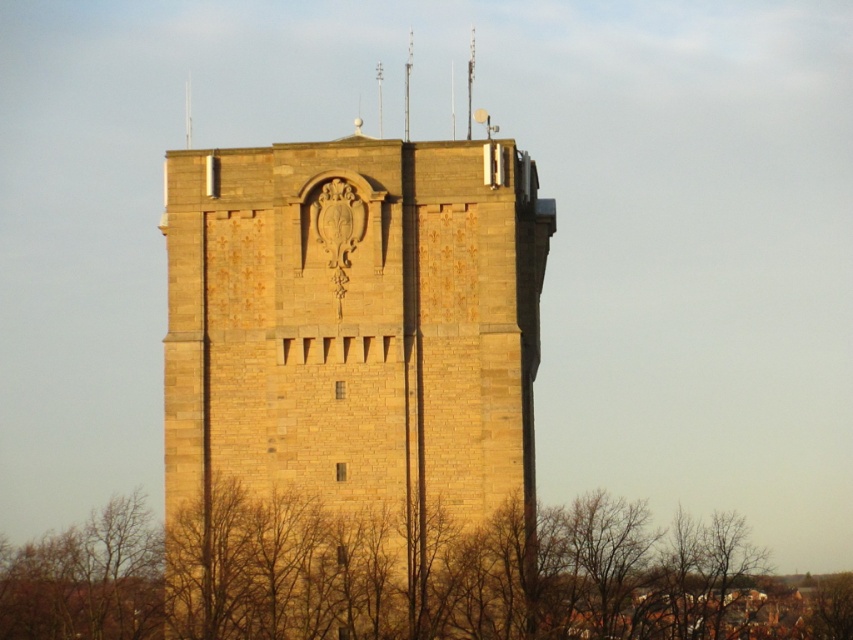
Question: Is golden stone tower at center above brown leafless branches at lower center?

Choices:
 (A) yes
 (B) no

Answer: (A)

Question: Does golden stone tower at center lie behind brown leafless branches at lower center?

Choices:
 (A) no
 (B) yes

Answer: (A)

Question: Can you confirm if golden stone tower at center is bigger than brown leafless branches at lower center?

Choices:
 (A) yes
 (B) no

Answer: (A)

Question: Which of the following is the farthest from the observer?

Choices:
 (A) brown leafless branches at lower center
 (B) golden stone tower at center

Answer: (A)